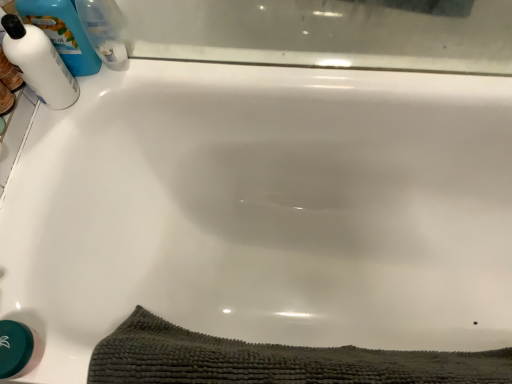
Question: Are dark gray textured bath towel at lower center and white glossy bottle at upper left, the 1th cleaning product in the left-to-right sequence, making contact?

Choices:
 (A) yes
 (B) no

Answer: (B)

Question: Is dark gray textured bath towel at lower center taller than white glossy bottle at upper left, the 1th cleaning product in the left-to-right sequence?

Choices:
 (A) no
 (B) yes

Answer: (B)

Question: Is dark gray textured bath towel at lower center outside white glossy bottle at upper left, the 1th cleaning product in the left-to-right sequence?

Choices:
 (A) yes
 (B) no

Answer: (A)

Question: Is white glossy bottle at upper left, the 1th cleaning product in the left-to-right sequence, at the back of dark gray textured bath towel at lower center?

Choices:
 (A) no
 (B) yes

Answer: (B)

Question: Is dark gray textured bath towel at lower center behind white glossy bottle at upper left, which is the 3th cleaning product in right-to-left order?

Choices:
 (A) no
 (B) yes

Answer: (A)

Question: From a real-world perspective, relative to white glossy bottle at upper left, the 2th cleaning product viewed from the right, is white glossy bottle at upper left, the 1th cleaning product in the left-to-right sequence, vertically above or below?

Choices:
 (A) below
 (B) above

Answer: (A)

Question: Considering the positions of point (15, 57) and point (47, 18), is point (15, 57) closer or farther from the camera than point (47, 18)?

Choices:
 (A) closer
 (B) farther

Answer: (A)

Question: Considering the positions of white glossy bottle at upper left, the 1th cleaning product in the left-to-right sequence, and white glossy bottle at upper left, the 2th cleaning product in the left-to-right sequence, in the image, is white glossy bottle at upper left, the 1th cleaning product in the left-to-right sequence, taller or shorter than white glossy bottle at upper left, the 2th cleaning product in the left-to-right sequence,?

Choices:
 (A) tall
 (B) short

Answer: (B)

Question: In the image, is white glossy bottle at upper left, the 1th cleaning product in the left-to-right sequence, positioned in front of or behind white glossy bottle at upper left, the 2th cleaning product in the left-to-right sequence?

Choices:
 (A) behind
 (B) front

Answer: (B)

Question: From the image's perspective, is dark gray textured bath towel at lower center above or below white glossy bottle at upper left, which is the 3th cleaning product in right-to-left order?

Choices:
 (A) above
 (B) below

Answer: (B)

Question: Does point (232, 359) appear closer or farther from the camera than point (41, 46)?

Choices:
 (A) farther
 (B) closer

Answer: (B)

Question: Looking at their shapes, would you say dark gray textured bath towel at lower center is wider or thinner than white glossy bottle at upper left, which is the 3th cleaning product in right-to-left order?

Choices:
 (A) wide
 (B) thin

Answer: (B)

Question: Looking at the image, does dark gray textured bath towel at lower center seem bigger or smaller compared to white glossy bottle at upper left, which is the 3th cleaning product in right-to-left order?

Choices:
 (A) big
 (B) small

Answer: (A)

Question: Considering the relative positions of white glossy bottle at upper left, the 2th cleaning product viewed from the right, and blue plastic bottle at upper left, arranged as the third cleaning product when viewed from the left, in the image provided, is white glossy bottle at upper left, the 2th cleaning product viewed from the right, to the left or to the right of blue plastic bottle at upper left, arranged as the third cleaning product when viewed from the left,?

Choices:
 (A) left
 (B) right

Answer: (A)

Question: From a real-world perspective, relative to blue plastic bottle at upper left, which is counted as the first cleaning product, starting from the right, is white glossy bottle at upper left, the 2th cleaning product viewed from the right, vertically above or below?

Choices:
 (A) below
 (B) above

Answer: (B)